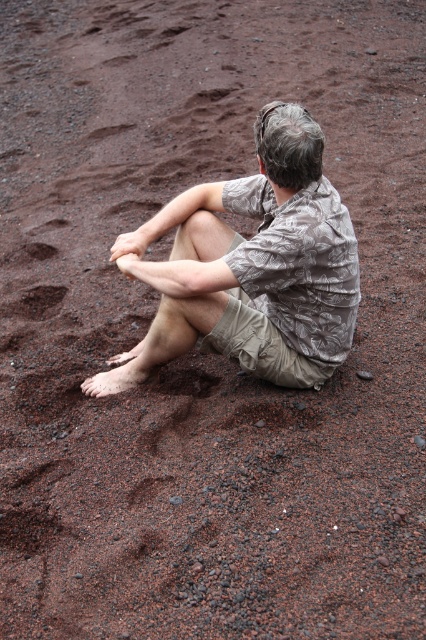
Question: Which point is closer to the camera?

Choices:
 (A) (37, 292)
 (B) (181, 337)
 (C) (210, 380)

Answer: (B)

Question: Is camouflage fabric shirt at center smaller than brown dirt footprint at lower left?

Choices:
 (A) no
 (B) yes

Answer: (A)

Question: Among these points, which one is farthest from the camera?

Choices:
 (A) (166, 330)
 (B) (48, 284)

Answer: (B)

Question: Is camouflage fabric shirt at center positioned at the back of brown dirt footprint at lower center?

Choices:
 (A) yes
 (B) no

Answer: (B)

Question: Based on their relative distances, which object is farther from the camouflage fabric shirt at center?

Choices:
 (A) brown dirt footprint at lower left
 (B) brown dirt footprint at lower center

Answer: (A)

Question: Is camouflage fabric shirt at center below brown dirt footprint at lower left?

Choices:
 (A) no
 (B) yes

Answer: (A)